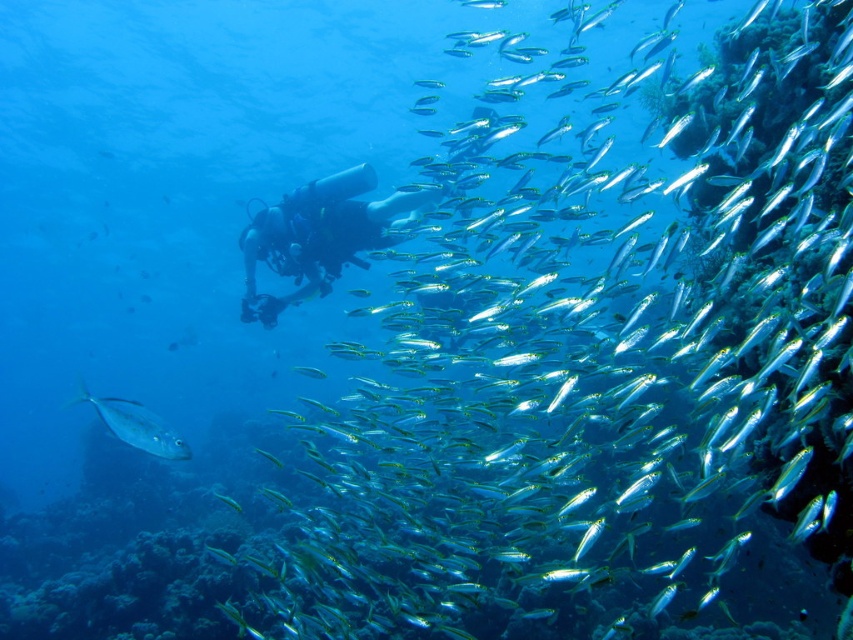
Is point (267, 211) positioned after point (97, 404)?

Yes.

Who is positioned more to the left, black matte scuba diver at center or shiny silver fish at lower left?

shiny silver fish at lower left

Find the location of a particular element. black matte scuba diver at center is located at coordinates (318, 236).